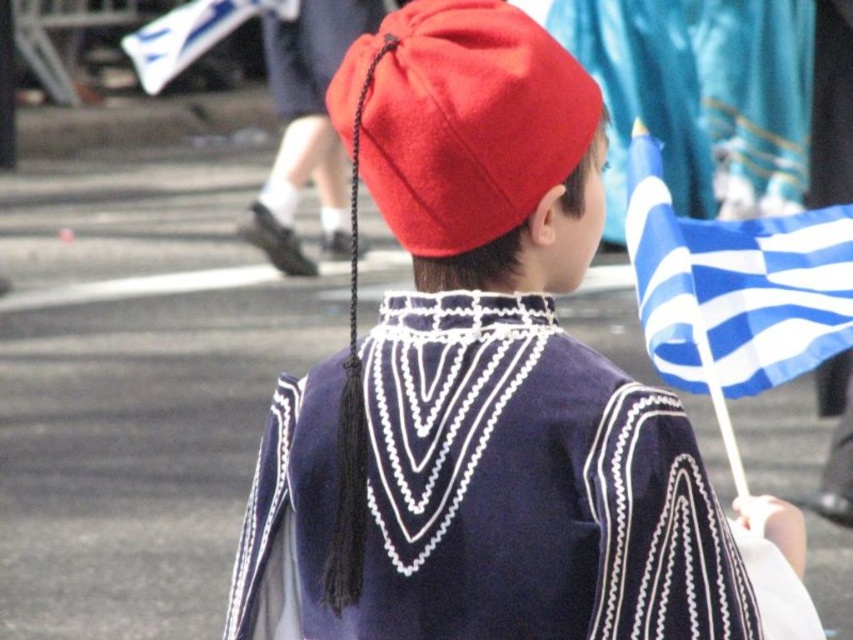
Question: Does matte red beret at center appear over matte red cap at center?

Choices:
 (A) no
 (B) yes

Answer: (A)

Question: Observing the image, what is the correct spatial positioning of matte red beret at center in reference to matte red cap at center?

Choices:
 (A) above
 (B) below

Answer: (B)

Question: Is matte red beret at center below blue fabric flag at right?

Choices:
 (A) no
 (B) yes

Answer: (B)

Question: Which of the following is the farthest from the observer?

Choices:
 (A) tap(416, 211)
 (B) tap(822, 321)
 (C) tap(405, 83)

Answer: (B)

Question: Which is nearer to the matte red cap at center?

Choices:
 (A) blue fabric flag at right
 (B) matte red beret at center

Answer: (B)

Question: Estimate the real-world distances between objects in this image. Which object is closer to the matte red beret at center?

Choices:
 (A) matte red cap at center
 (B) blue fabric flag at right

Answer: (A)